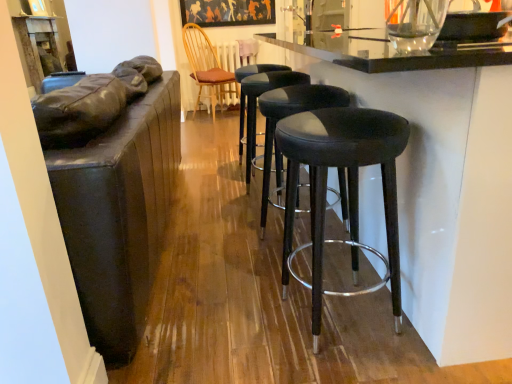
Question: Looking at the image, does black leather bar stools at center seem bigger or smaller compared to wooden chair with cushion at center?

Choices:
 (A) big
 (B) small

Answer: (A)

Question: Is black leather bar stools at center situated inside wooden chair with cushion at center or outside?

Choices:
 (A) outside
 (B) inside

Answer: (A)

Question: Estimate the real-world distances between objects in this image. Which object is farther from the matte black table at upper left?

Choices:
 (A) black leather stool at center, the second stool positioned from the front
 (B) wooden chair with cushion at center
 (C) black leather stool at center, the first stool when ordered from back to front
 (D) matte black frame at upper center
 (E) black leather bar stools at center

Answer: (D)

Question: Estimate the real-world distances between objects in this image. Which object is farther from the matte black stool at center, acting as the third stool starting from the back?

Choices:
 (A) matte black table at upper left
 (B) wooden chair with cushion at center
 (C) black leather stool at center, which is the second stool from back to front
 (D) matte black frame at upper center
 (E) black leather stool at center, marked as the third stool in a front-to-back arrangement

Answer: (B)